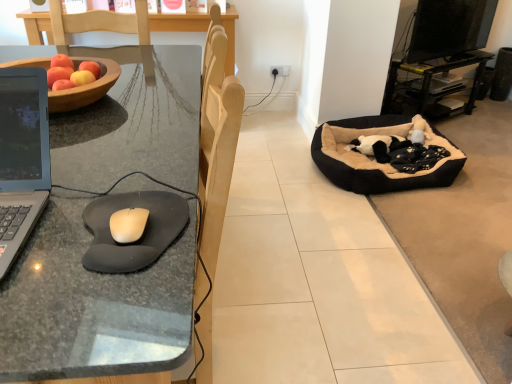
Identify the location of empty space that is ontop of black foam mousepad at left. (133, 229).